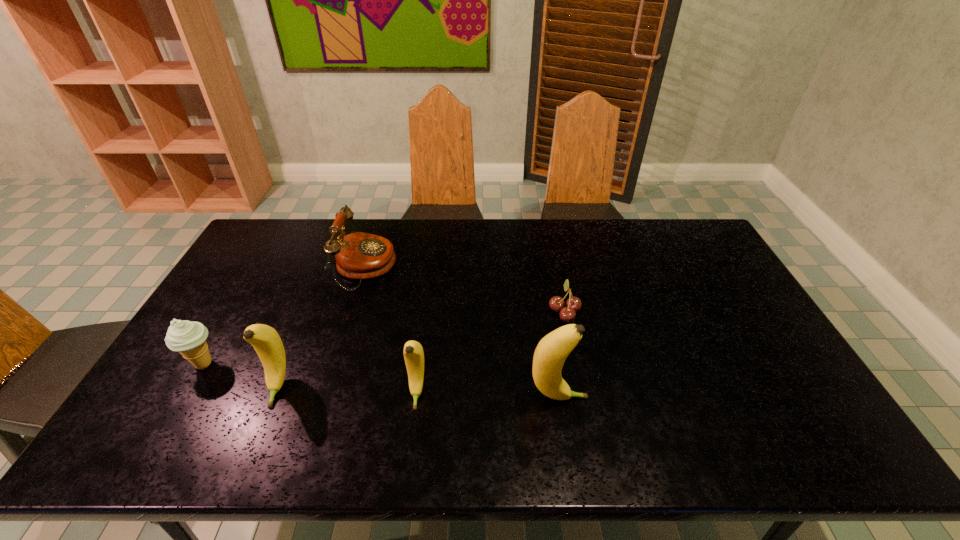
Locate an element on the screen. vacant position at the left edge of the desktop is located at coordinates (260, 262).

At what (x,y) coordinates should I click in order to perform the action: click on vacant space at the right edge. Please return your answer as a coordinate pair (x, y). This screenshot has height=540, width=960. Looking at the image, I should click on (758, 328).

In the image, there is a desktop. Identify the location of vacant space at the far left corner. The height and width of the screenshot is (540, 960). (300, 221).

Where is `vacant point at the far right corner`? This screenshot has height=540, width=960. vacant point at the far right corner is located at coordinates click(669, 221).

The image size is (960, 540). In the image, there is a desktop. What are the coordinates of `free region at the near right corner` in the screenshot? It's located at pyautogui.click(x=779, y=407).

Identify the location of vacant space in between the cherry and the leftmost object. (384, 338).

Identify the location of free space between the telephone and the second shortest banana. The height and width of the screenshot is (540, 960). (322, 327).

At what (x,y) coordinates should I click in order to perform the action: click on vacant space in between the shortest banana and the icecream. Please return your answer as a coordinate pair (x, y). Image resolution: width=960 pixels, height=540 pixels. Looking at the image, I should click on (310, 378).

The width and height of the screenshot is (960, 540). Identify the location of vacant space in between the second banana from right to left and the cherry. (491, 352).

Where is `empty location between the rightmost banana and the fourth object from right to left`? empty location between the rightmost banana and the fourth object from right to left is located at coordinates (462, 333).